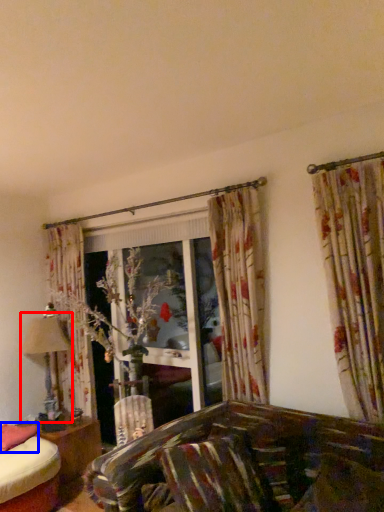
Question: Among these objects, which one is nearest to the camera, table lamp (highlighted by a red box) or pillow (highlighted by a blue box)?

Choices:
 (A) table lamp
 (B) pillow

Answer: (B)